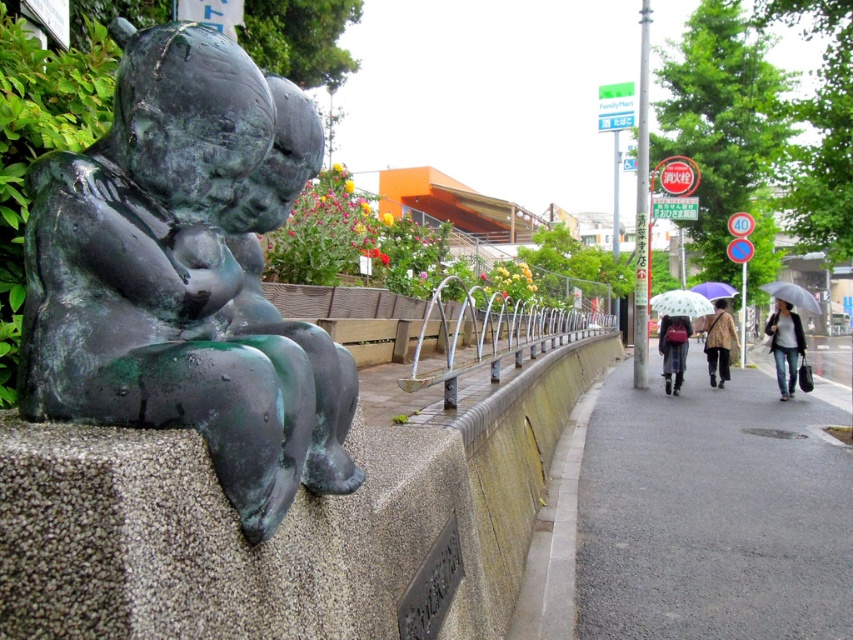
Which is more to the right, gray asphalt pavement at lower right or transparent fabric umbrella at center?

transparent fabric umbrella at center is more to the right.

Measure the distance from gray asphalt pavement at lower right to transparent fabric umbrella at center.

3.79 meters

Is point (759, 412) positioned after point (653, 305)?

No, it is not.

Identify the location of gray asphalt pavement at lower right. This screenshot has width=853, height=640. (712, 515).

Does denim jacket at lower right appear on the left side of transparent plastic umbrella at right?

Yes, denim jacket at lower right is to the left of transparent plastic umbrella at right.

Who is positioned more to the right, denim jacket at lower right or transparent plastic umbrella at right?

transparent plastic umbrella at right is more to the right.

Does point (793, 316) lie in front of point (811, 307)?

No, it is not.

Where is `denim jacket at lower right`? denim jacket at lower right is located at coordinates (785, 344).

Is point (453, 369) positioned behind point (706, 307)?

No, (453, 369) is closer to viewer.

Between silver metallic rail at center and transparent fabric umbrella at center, which one appears on the right side from the viewer's perspective?

Positioned to the right is transparent fabric umbrella at center.

Find the location of `silver metallic rail at center`. silver metallic rail at center is located at coordinates (496, 333).